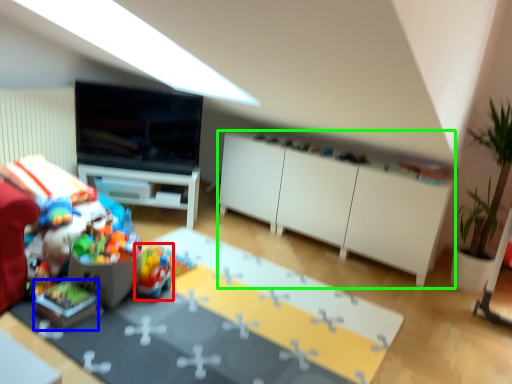
Question: Which is nearer to the toy (highlighted by a red box)? toy (highlighted by a blue box) or cabinetry (highlighted by a green box).

Choices:
 (A) toy
 (B) cabinetry

Answer: (A)